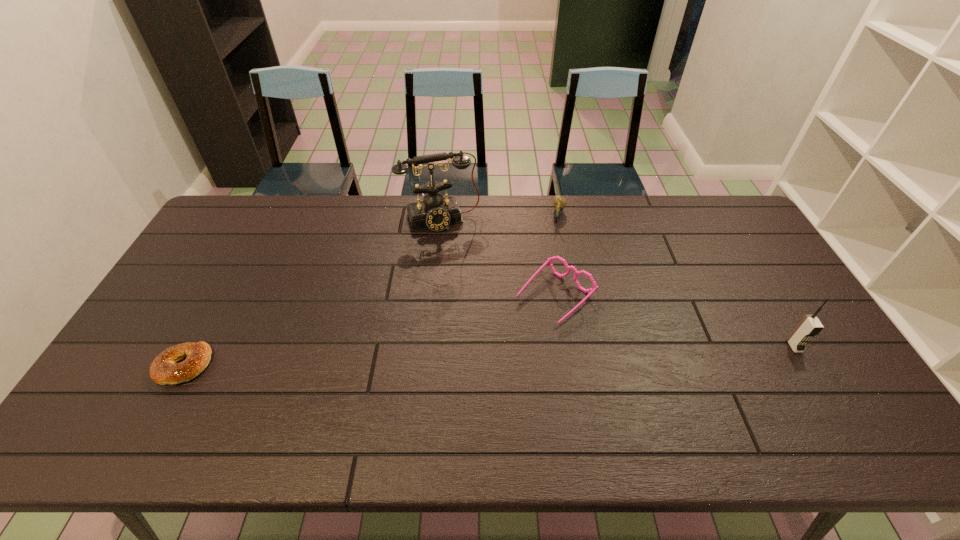
I want to click on free space between the rightmost object and the shortest object, so click(489, 356).

The width and height of the screenshot is (960, 540). I want to click on object that is the fourth closest to the second shortest object, so click(164, 370).

The image size is (960, 540). I want to click on object that stands as the third closest to the shortest object, so click(x=559, y=202).

Image resolution: width=960 pixels, height=540 pixels. What are the coordinates of `vacant area in the image that satisfies the following two spatial constraints: 1. on the back side of the third farthest object; 2. on the right side of the escargot` in the screenshot? It's located at (542, 215).

The image size is (960, 540). I want to click on free location that satisfies the following two spatial constraints: 1. on the front side of the telephone; 2. on the left side of the third nearest object, so click(x=433, y=296).